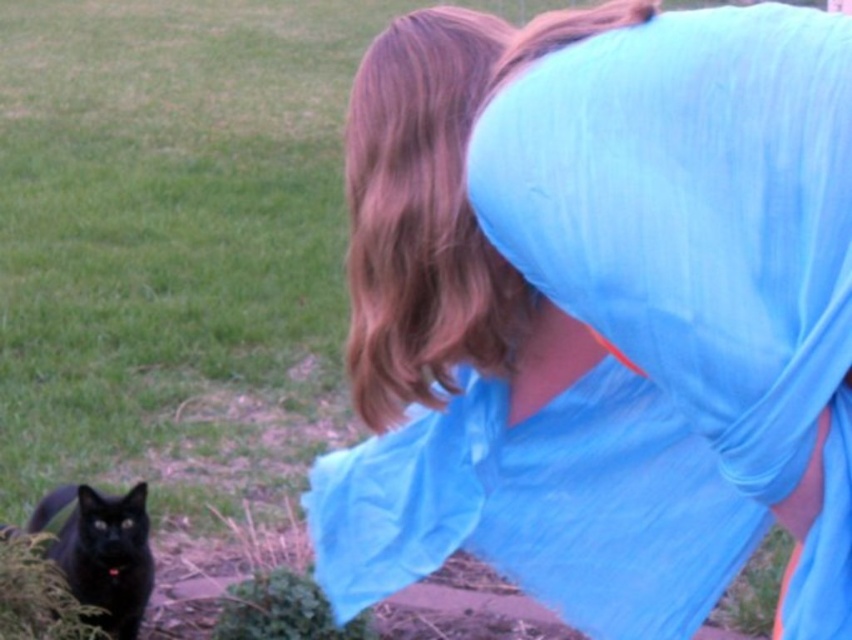
Question: Can you confirm if blue fabric shirt at center is positioned below shiny black cat at lower left?

Choices:
 (A) no
 (B) yes

Answer: (A)

Question: Which object is farther from the camera taking this photo?

Choices:
 (A) blue fabric shirt at center
 (B) shiny black cat at lower left

Answer: (B)

Question: Is blue fabric shirt at center wider than shiny black cat at lower left?

Choices:
 (A) no
 (B) yes

Answer: (B)

Question: Does blue fabric shirt at center have a smaller size compared to shiny black cat at lower left?

Choices:
 (A) yes
 (B) no

Answer: (B)

Question: Which point is closer to the camera taking this photo?

Choices:
 (A) (108, 540)
 (B) (482, 177)

Answer: (B)

Question: Which point is farther to the camera?

Choices:
 (A) (84, 552)
 (B) (694, 595)

Answer: (A)